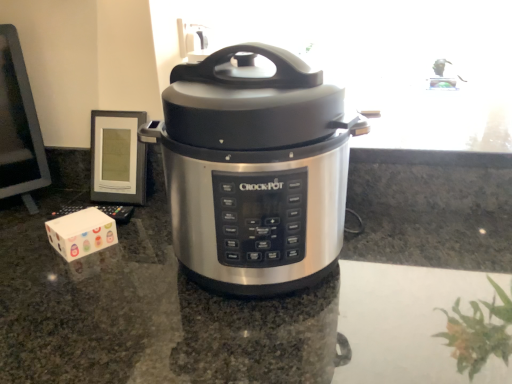
Question: From a real-world perspective, is stainless steel slow cooker at center on stainless steel countertop at center?

Choices:
 (A) yes
 (B) no

Answer: (A)

Question: From the image's perspective, is stainless steel slow cooker at center above stainless steel countertop at center?

Choices:
 (A) yes
 (B) no

Answer: (A)

Question: From the image's perspective, is stainless steel slow cooker at center under stainless steel countertop at center?

Choices:
 (A) yes
 (B) no

Answer: (B)

Question: Can you confirm if stainless steel slow cooker at center is positioned to the left of stainless steel countertop at center?

Choices:
 (A) no
 (B) yes

Answer: (B)

Question: Is stainless steel countertop at center surrounded by stainless steel slow cooker at center?

Choices:
 (A) no
 (B) yes

Answer: (A)

Question: Is stainless steel slow cooker at center looking in the opposite direction of stainless steel countertop at center?

Choices:
 (A) yes
 (B) no

Answer: (B)

Question: From a real-world perspective, is white cardboard box at lower left on stainless steel slow cooker at center?

Choices:
 (A) no
 (B) yes

Answer: (A)

Question: Is white cardboard box at lower left far from stainless steel slow cooker at center?

Choices:
 (A) no
 (B) yes

Answer: (A)

Question: Is white cardboard box at lower left thinner than stainless steel slow cooker at center?

Choices:
 (A) yes
 (B) no

Answer: (A)

Question: Is white cardboard box at lower left to the right of stainless steel slow cooker at center from the viewer's perspective?

Choices:
 (A) yes
 (B) no

Answer: (B)

Question: Would you say white cardboard box at lower left is outside stainless steel slow cooker at center?

Choices:
 (A) no
 (B) yes

Answer: (B)

Question: Is white cardboard box at lower left surrounding stainless steel slow cooker at center?

Choices:
 (A) no
 (B) yes

Answer: (A)

Question: Can you confirm if stainless steel slow cooker at center is thinner than white cardboard box at lower left?

Choices:
 (A) yes
 (B) no

Answer: (B)